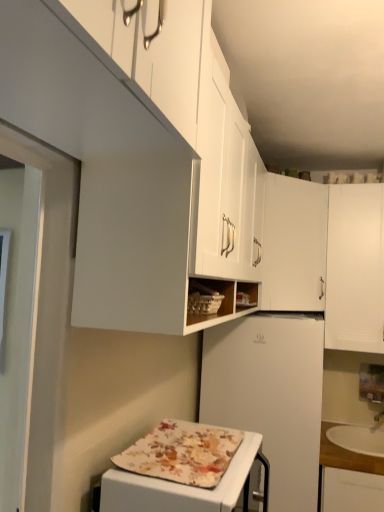
Describe the element at coordinates (346, 456) in the screenshot. I see `wooden countertop at lower right` at that location.

At what (x,y) coordinates should I click in order to perform the action: click on wooden countertop at lower right. Please return your answer as a coordinate pair (x, y). The image size is (384, 512). Looking at the image, I should click on (346, 456).

Looking at this image, what is the approximate height of white matte cabinet at upper center, the 2th cabinetry from the right?

28.57 inches.

The width and height of the screenshot is (384, 512). Describe the element at coordinates (355, 268) in the screenshot. I see `white matte cabinet at upper right, which is the 1th cabinetry from right to left` at that location.

What do you see at coordinates (270, 395) in the screenshot?
I see `white matte refrigerator at center` at bounding box center [270, 395].

This screenshot has width=384, height=512. I want to click on wooden countertop at lower right, so click(346, 456).

Does white matte refrigerator at center lie in front of white matte cabinet at upper center, the 2th cabinetry positioned from the left?

Yes, white matte refrigerator at center is in front of white matte cabinet at upper center, the 2th cabinetry positioned from the left.

How many degrees apart are the facing directions of white matte refrigerator at center and white matte cabinet at upper center, the 2th cabinetry from the right?

white matte refrigerator at center and white matte cabinet at upper center, the 2th cabinetry from the right, are facing 43.6 degrees away from each other.

Based on the photo, is white matte refrigerator at center not within white matte cabinet at upper center, the 2th cabinetry from the right?

white matte refrigerator at center is positioned outside white matte cabinet at upper center, the 2th cabinetry from the right.

Looking at this image, from the image's perspective, who appears lower, white matte refrigerator at center or white matte cabinet at upper center, the 2th cabinetry positioned from the left?

white matte refrigerator at center.

From the image's perspective, would you say wooden countertop at lower right is positioned over floral fabric-covered appliance at lower center?

Incorrect, from the image's perspective, wooden countertop at lower right is lower than floral fabric-covered appliance at lower center.

From a real-world perspective, which is physically below, wooden countertop at lower right or floral fabric-covered appliance at lower center?

From a 3D spatial view, wooden countertop at lower right is below.

Are wooden countertop at lower right and floral fabric-covered appliance at lower center beside each other?

wooden countertop at lower right is not next to floral fabric-covered appliance at lower center, and they're not touching.

Is wooden countertop at lower right positioned beyond the bounds of floral fabric-covered appliance at lower center?

Yes, wooden countertop at lower right is located beyond the bounds of floral fabric-covered appliance at lower center.

From the image's perspective, relative to wooden countertop at lower right, is floral fabric-covered appliance at lower center above or below?

Based on their image positions, floral fabric-covered appliance at lower center is located above wooden countertop at lower right.

From a real-world perspective, is floral fabric-covered appliance at lower center located higher than wooden countertop at lower right?

Yes.

Is floral fabric-covered appliance at lower center looking in the opposite direction of wooden countertop at lower right?

No.

Can you confirm if floral fabric-covered appliance at lower center is wider than wooden countertop at lower right?

In fact, floral fabric-covered appliance at lower center might be narrower than wooden countertop at lower right.

Can you confirm if white matte cabinet at upper center, the 2th cabinetry from the right, is bigger than floral fabric-covered appliance at lower center?

Correct, white matte cabinet at upper center, the 2th cabinetry from the right, is larger in size than floral fabric-covered appliance at lower center.

In the scene shown: Can you confirm if white matte cabinet at upper center, the 2th cabinetry from the right, is thinner than floral fabric-covered appliance at lower center?

No.

Is white matte cabinet at upper center, the 2th cabinetry from the right, facing towards floral fabric-covered appliance at lower center?

No, white matte cabinet at upper center, the 2th cabinetry from the right, is not oriented towards floral fabric-covered appliance at lower center.

From a real-world perspective, who is located higher, white matte cabinet at upper center, the 2th cabinetry positioned from the left, or floral fabric-covered appliance at lower center?

white matte cabinet at upper center, the 2th cabinetry positioned from the left.

Which of these two, white matte refrigerator at center or white matte cabinet at upper right, arranged as the third cabinetry when viewed from the left, is thinner?

With smaller width is white matte cabinet at upper right, arranged as the third cabinetry when viewed from the left.

Can you tell me how much white matte refrigerator at center and white matte cabinet at upper right, arranged as the third cabinetry when viewed from the left, differ in facing direction?

2.17 degrees separate the facing orientations of white matte refrigerator at center and white matte cabinet at upper right, arranged as the third cabinetry when viewed from the left.

Considering the sizes of objects white matte refrigerator at center and white matte cabinet at upper right, arranged as the third cabinetry when viewed from the left, in the image provided, who is bigger, white matte refrigerator at center or white matte cabinet at upper right, arranged as the third cabinetry when viewed from the left,?

With larger size is white matte refrigerator at center.

Considering the relative sizes of white matte refrigerator at center and white matte cabinet at upper right, arranged as the third cabinetry when viewed from the left, in the image provided, is white matte refrigerator at center shorter than white matte cabinet at upper right, arranged as the third cabinetry when viewed from the left,?

In fact, white matte refrigerator at center may be taller than white matte cabinet at upper right, arranged as the third cabinetry when viewed from the left.

From the image's perspective, would you say white matte cabinet at upper right, arranged as the third cabinetry when viewed from the left, is shown under floral fabric-covered appliance at lower center?

No, from the image's perspective, white matte cabinet at upper right, arranged as the third cabinetry when viewed from the left, is not below floral fabric-covered appliance at lower center.

From a real-world perspective, is white matte cabinet at upper right, which is the 1th cabinetry from right to left, located beneath floral fabric-covered appliance at lower center?

No, from a real-world perspective, white matte cabinet at upper right, which is the 1th cabinetry from right to left, is not beneath floral fabric-covered appliance at lower center.

Is white matte cabinet at upper right, arranged as the third cabinetry when viewed from the left, taller or shorter than floral fabric-covered appliance at lower center?

white matte cabinet at upper right, arranged as the third cabinetry when viewed from the left, is taller than floral fabric-covered appliance at lower center.

Based on the photo, is floral fabric-covered appliance at lower center located within white matte cabinet at upper right, which is the 1th cabinetry from right to left?

No, floral fabric-covered appliance at lower center is located outside of white matte cabinet at upper right, which is the 1th cabinetry from right to left.

Considering the sizes of objects wooden countertop at lower right and white matte cabinet at upper center, placed as the 1th cabinetry when sorted from left to right, in the image provided, who is wider, wooden countertop at lower right or white matte cabinet at upper center, placed as the 1th cabinetry when sorted from left to right,?

Wider between the two is wooden countertop at lower right.

Which of these two, wooden countertop at lower right or white matte cabinet at upper center, placed as the 1th cabinetry when sorted from left to right, is smaller?

wooden countertop at lower right is smaller.

Based on the photo, is there a large distance between wooden countertop at lower right and white matte cabinet at upper center, placed as the 1th cabinetry when sorted from left to right?

Yes, wooden countertop at lower right is far from white matte cabinet at upper center, placed as the 1th cabinetry when sorted from left to right.

From a real-world perspective, is wooden countertop at lower right physically below white matte cabinet at upper center, placed as the 1th cabinetry when sorted from left to right?

Correct, in the physical world, wooden countertop at lower right is lower than white matte cabinet at upper center, placed as the 1th cabinetry when sorted from left to right.

Identify the location of cabinetry that is the 2nd object located above the white matte refrigerator at center (from the image's perspective). Image resolution: width=384 pixels, height=512 pixels. pyautogui.click(x=294, y=244).

This screenshot has width=384, height=512. What are the coordinates of `countertop behind the floral fabric-covered appliance at lower center` in the screenshot? It's located at (346, 456).

When comparing their distances from wooden countertop at lower right, does white matte refrigerator at center or white matte cabinet at upper right, arranged as the third cabinetry when viewed from the left, seem further?

white matte cabinet at upper right, arranged as the third cabinetry when viewed from the left, lies further to wooden countertop at lower right than the other object.

Based on the photo, when comparing their distances from white matte cabinet at upper right, arranged as the third cabinetry when viewed from the left, does white matte cabinet at upper center, the 2th cabinetry positioned from the left, or floral fabric-covered appliance at lower center seem closer?

Among the two, white matte cabinet at upper center, the 2th cabinetry positioned from the left, is located nearer to white matte cabinet at upper right, arranged as the third cabinetry when viewed from the left.

Considering their positions, is white matte cabinet at upper center, placed as the 1th cabinetry when sorted from left to right, positioned closer to floral fabric-covered appliance at lower center than white matte cabinet at upper center, the 2th cabinetry from the right?

Based on the image, white matte cabinet at upper center, placed as the 1th cabinetry when sorted from left to right, appears to be nearer to floral fabric-covered appliance at lower center.

Looking at the image, which one is located closer to floral fabric-covered appliance at lower center, wooden countertop at lower right or white matte refrigerator at center?

Among the two, white matte refrigerator at center is located nearer to floral fabric-covered appliance at lower center.

Which object lies nearer to the anchor point white matte cabinet at upper center, the 2th cabinetry positioned from the left, white matte cabinet at upper right, arranged as the third cabinetry when viewed from the left, or wooden countertop at lower right?

white matte cabinet at upper right, arranged as the third cabinetry when viewed from the left.

When comparing their distances from white matte cabinet at upper right, arranged as the third cabinetry when viewed from the left, does floral fabric-covered appliance at lower center or white matte refrigerator at center seem closer?

The object closer to white matte cabinet at upper right, arranged as the third cabinetry when viewed from the left, is white matte refrigerator at center.

Based on their spatial positions, is wooden countertop at lower right or white matte cabinet at upper right, arranged as the third cabinetry when viewed from the left, closer to floral fabric-covered appliance at lower center?

wooden countertop at lower right lies closer to floral fabric-covered appliance at lower center than the other object.

When comparing their distances from white matte cabinet at upper center, which appears as the third cabinetry when viewed from the right, does floral fabric-covered appliance at lower center or white matte refrigerator at center seem closer?

floral fabric-covered appliance at lower center lies closer to white matte cabinet at upper center, which appears as the third cabinetry when viewed from the right, than the other object.

At what (x,y) coordinates should I click in order to perform the action: click on refrigerator positioned between floral fabric-covered appliance at lower center and white matte cabinet at upper center, the 2th cabinetry from the right, from near to far. Please return your answer as a coordinate pair (x, y). Image resolution: width=384 pixels, height=512 pixels. Looking at the image, I should click on (270, 395).

At what (x,y) coordinates should I click in order to perform the action: click on refrigerator located between white matte cabinet at upper center, which appears as the third cabinetry when viewed from the right, and white matte cabinet at upper center, the 2th cabinetry from the right, in the depth direction. Please return your answer as a coordinate pair (x, y). The image size is (384, 512). Looking at the image, I should click on (270, 395).

Locate an element on the screen. This screenshot has width=384, height=512. appliance between white matte cabinet at upper center, placed as the 1th cabinetry when sorted from left to right, and white matte refrigerator at center, in the vertical direction is located at coordinates (181, 487).

The height and width of the screenshot is (512, 384). In order to click on cabinetry positioned between white matte cabinet at upper center, placed as the 1th cabinetry when sorted from left to right, and white matte cabinet at upper right, arranged as the third cabinetry when viewed from the left, from near to far in this screenshot , I will do `click(294, 244)`.